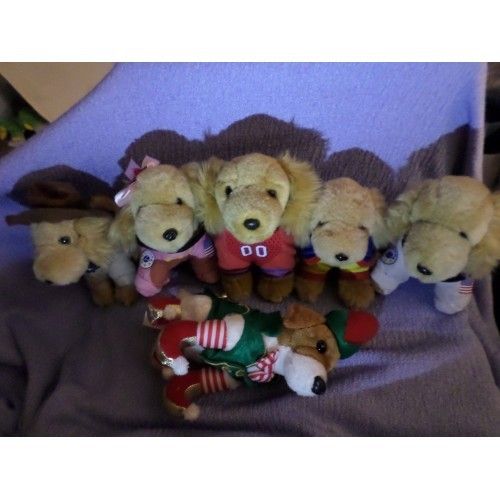
I want to click on stuffed animal dogs, so click(x=65, y=203), click(x=142, y=214), click(x=259, y=217), click(x=350, y=233), click(x=432, y=236), click(x=271, y=317).